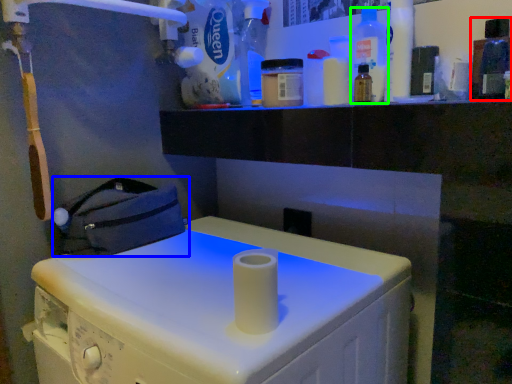
Question: Estimate the real-world distances between objects in this image. Which object is closer to bottle (highlighted by a red box), bag (highlighted by a blue box) or bottle (highlighted by a green box)?

Choices:
 (A) bag
 (B) bottle

Answer: (B)